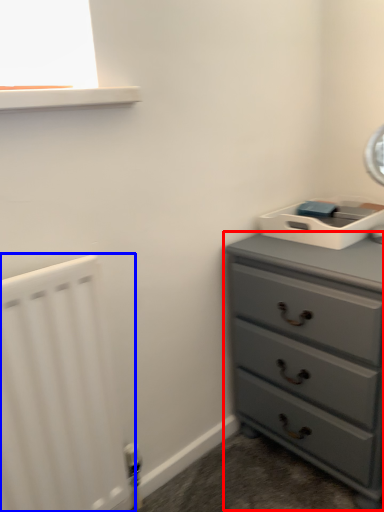
Question: Among these objects, which one is farthest to the camera, chest of drawers (highlighted by a red box) or radiator (highlighted by a blue box)?

Choices:
 (A) chest of drawers
 (B) radiator

Answer: (A)